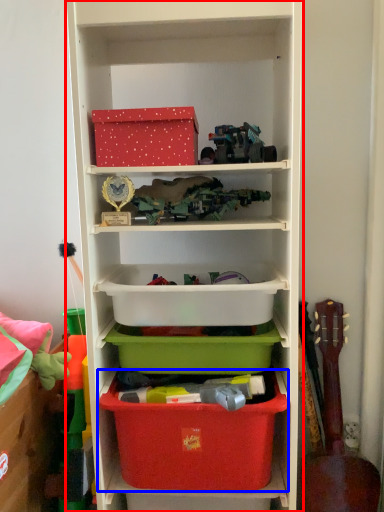
Question: Which object appears closest to the camera in this image, shelf (highlighted by a red box) or storage box (highlighted by a blue box)?

Choices:
 (A) shelf
 (B) storage box

Answer: (A)